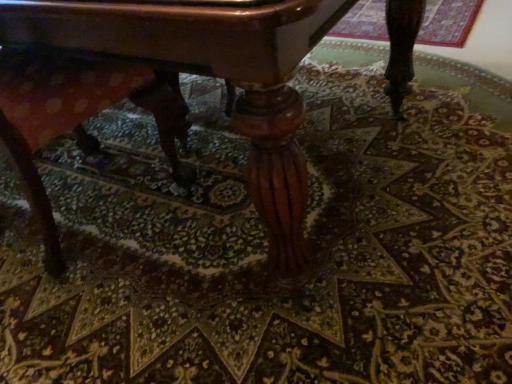
Question: In the image, is polished wood table at center on the left side or the right side of wooden swivel chair at lower left?

Choices:
 (A) right
 (B) left

Answer: (A)

Question: Choose the correct answer: Is polished wood table at center inside wooden swivel chair at lower left or outside it?

Choices:
 (A) outside
 (B) inside

Answer: (A)

Question: From the image's perspective, is polished wood table at center above or below wooden swivel chair at lower left?

Choices:
 (A) above
 (B) below

Answer: (A)

Question: In terms of height, does wooden swivel chair at lower left look taller or shorter compared to polished wood table at center?

Choices:
 (A) short
 (B) tall

Answer: (A)

Question: Do you think wooden swivel chair at lower left is within polished wood table at center, or outside of it?

Choices:
 (A) outside
 (B) inside

Answer: (B)

Question: From the image's perspective, is wooden swivel chair at lower left above or below polished wood table at center?

Choices:
 (A) above
 (B) below

Answer: (B)

Question: Considering the positions of wooden swivel chair at lower left and polished wood table at center in the image, is wooden swivel chair at lower left wider or thinner than polished wood table at center?

Choices:
 (A) wide
 (B) thin

Answer: (B)